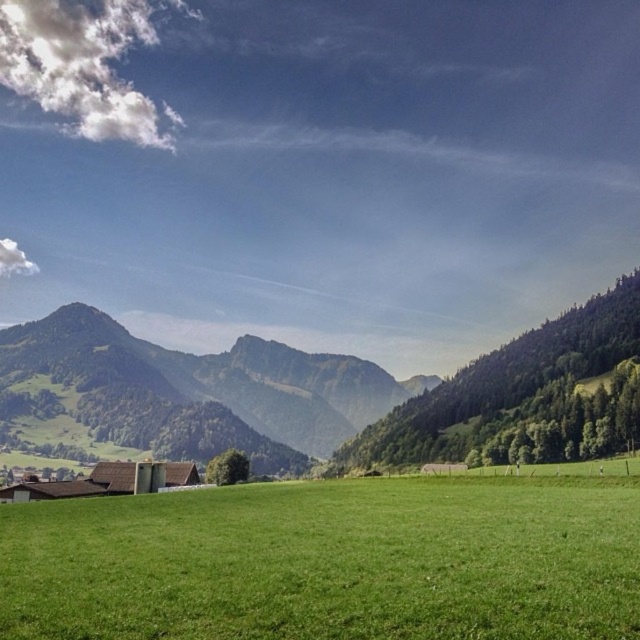
You are standing in the meadow looking at the landscape. There are two points marked in the image. Which point is closer to you, point (289, 500) or point (452, 438)?

Point (289, 500) is closer to the viewer than point (452, 438).